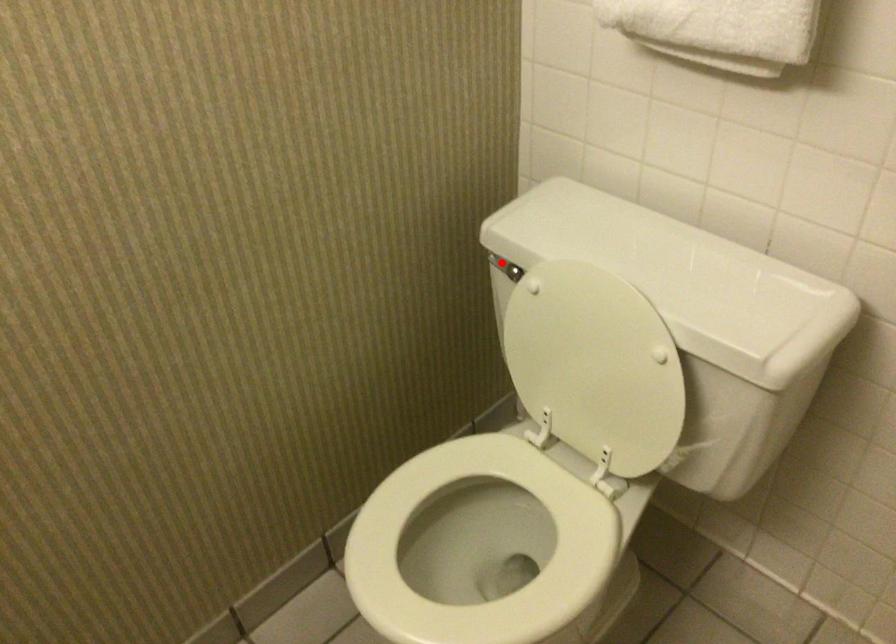
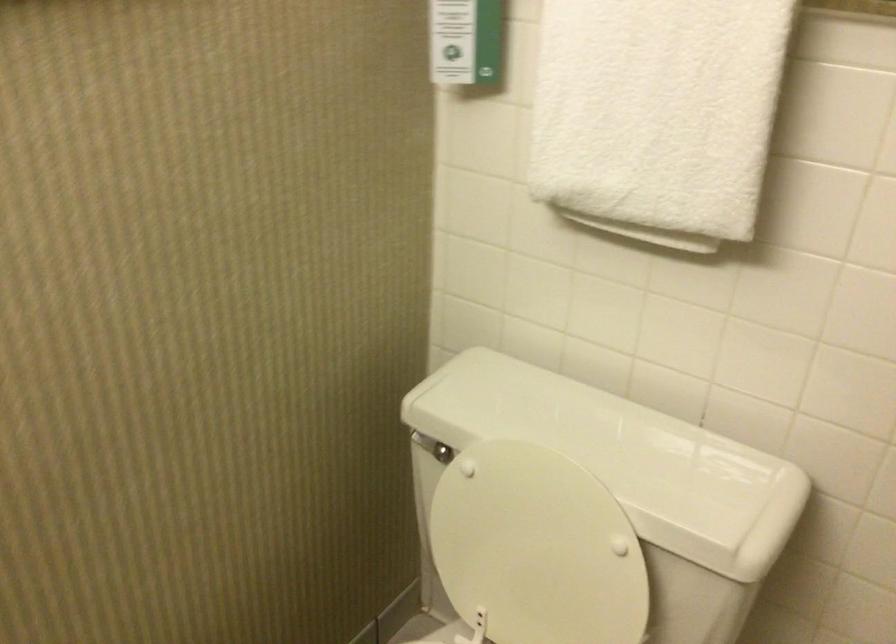
Question: I am providing you with two images of the same scene from different viewpoints. In image1, a red point is highlighted. Considering the same 3D point in image2, which of the following is correct?

Choices:
 (A) It is closer
 (B) It is farther

Answer: (A)